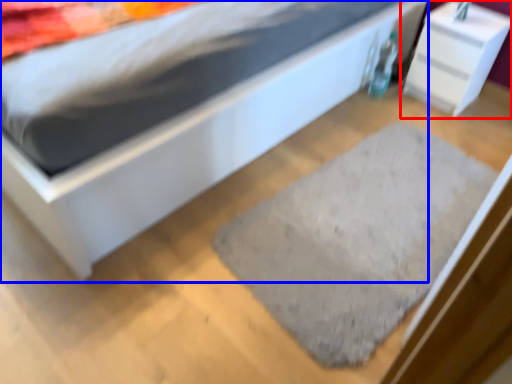
Question: Which object is closer to the camera taking this photo, nightstand (highlighted by a red box) or bed (highlighted by a blue box)?

Choices:
 (A) nightstand
 (B) bed

Answer: (B)